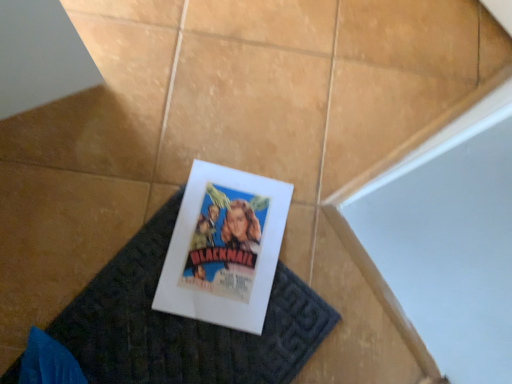
Where is `vacant area on top of dark gray textured doormat at center (from a real-world perspective)`? vacant area on top of dark gray textured doormat at center (from a real-world perspective) is located at coordinates (187, 312).